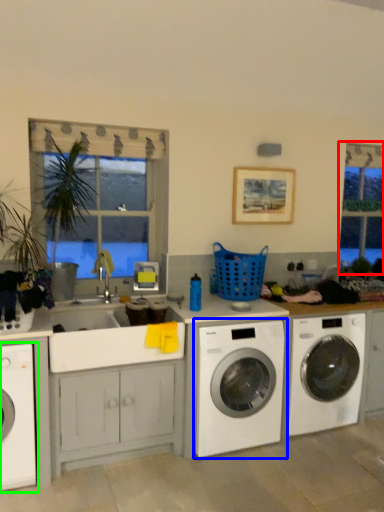
Question: Based on their relative distances, which object is farther from bay window (highlighted by a red box)? Choose from washing machine (highlighted by a blue box) and washing machine (highlighted by a green box).

Choices:
 (A) washing machine
 (B) washing machine

Answer: (B)